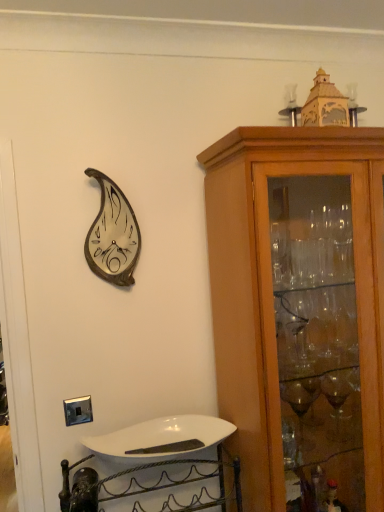
Question: Is light brown wood cabinet at right next to metallic silver clock at upper left?

Choices:
 (A) no
 (B) yes

Answer: (A)

Question: From the image's perspective, is light brown wood cabinet at right located above metallic silver clock at upper left?

Choices:
 (A) no
 (B) yes

Answer: (A)

Question: From a real-world perspective, does light brown wood cabinet at right stand above metallic silver clock at upper left?

Choices:
 (A) yes
 (B) no

Answer: (B)

Question: Considering the relative sizes of light brown wood cabinet at right and metallic silver clock at upper left in the image provided, is light brown wood cabinet at right thinner than metallic silver clock at upper left?

Choices:
 (A) no
 (B) yes

Answer: (A)

Question: Is metallic silver clock at upper left inside light brown wood cabinet at right?

Choices:
 (A) yes
 (B) no

Answer: (B)

Question: Considering the positions of point 125,234 and point 178,477, is point 125,234 closer or farther from the camera than point 178,477?

Choices:
 (A) closer
 (B) farther

Answer: (A)

Question: Considering the relative positions of metallic silver clock at upper left and white glossy sink at lower center in the image provided, is metallic silver clock at upper left to the left or to the right of white glossy sink at lower center?

Choices:
 (A) left
 (B) right

Answer: (A)

Question: From the image's perspective, relative to white glossy sink at lower center, is metallic silver clock at upper left above or below?

Choices:
 (A) above
 (B) below

Answer: (A)

Question: Considering the positions of metallic silver clock at upper left and white glossy sink at lower center in the image, is metallic silver clock at upper left taller or shorter than white glossy sink at lower center?

Choices:
 (A) short
 (B) tall

Answer: (B)

Question: Considering the positions of metallic silver clock at upper left and light brown wood cabinet at right in the image, is metallic silver clock at upper left wider or thinner than light brown wood cabinet at right?

Choices:
 (A) wide
 (B) thin

Answer: (B)

Question: Is metallic silver clock at upper left to the left or to the right of light brown wood cabinet at right in the image?

Choices:
 (A) right
 (B) left

Answer: (B)

Question: From the image's perspective, is metallic silver clock at upper left positioned above or below light brown wood cabinet at right?

Choices:
 (A) above
 (B) below

Answer: (A)

Question: Would you say metallic silver clock at upper left is inside or outside light brown wood cabinet at right?

Choices:
 (A) outside
 (B) inside

Answer: (A)

Question: From the image's perspective, is white glossy sink at lower center located above or below light brown wood cabinet at right?

Choices:
 (A) below
 (B) above

Answer: (A)

Question: Considering the positions of point (180, 509) and point (322, 227), is point (180, 509) closer or farther from the camera than point (322, 227)?

Choices:
 (A) closer
 (B) farther

Answer: (A)